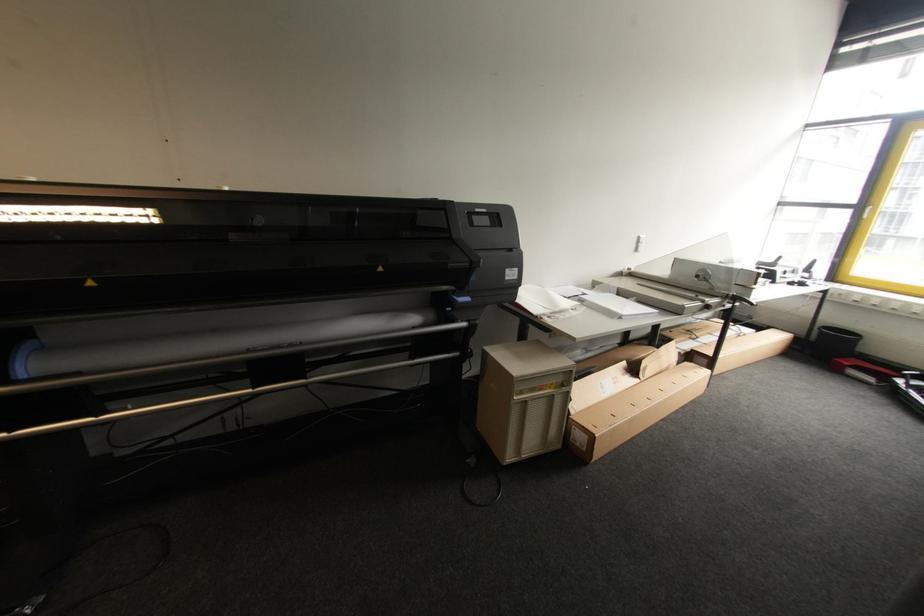
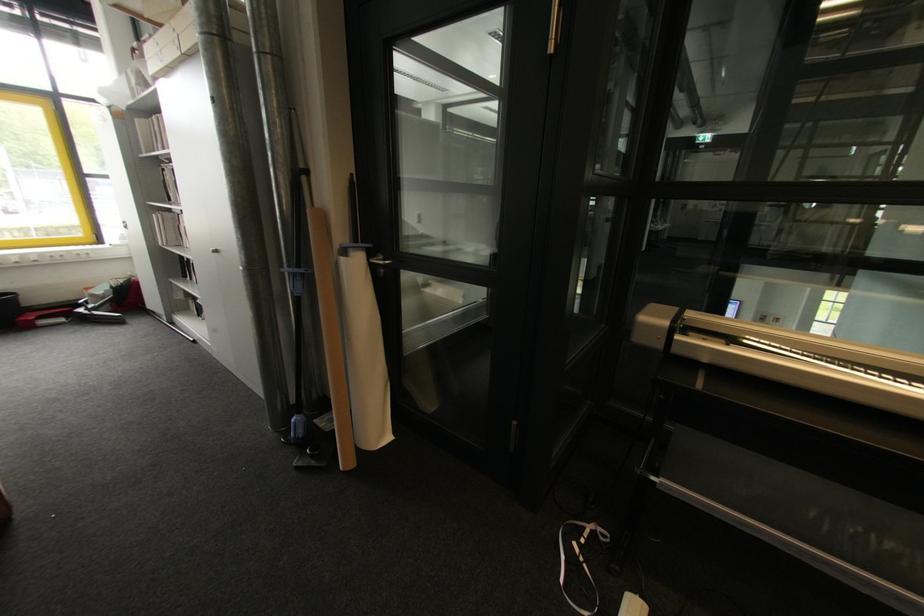
Where in the second image is the point corresponding to point 874,381 from the first image?

(66, 321)